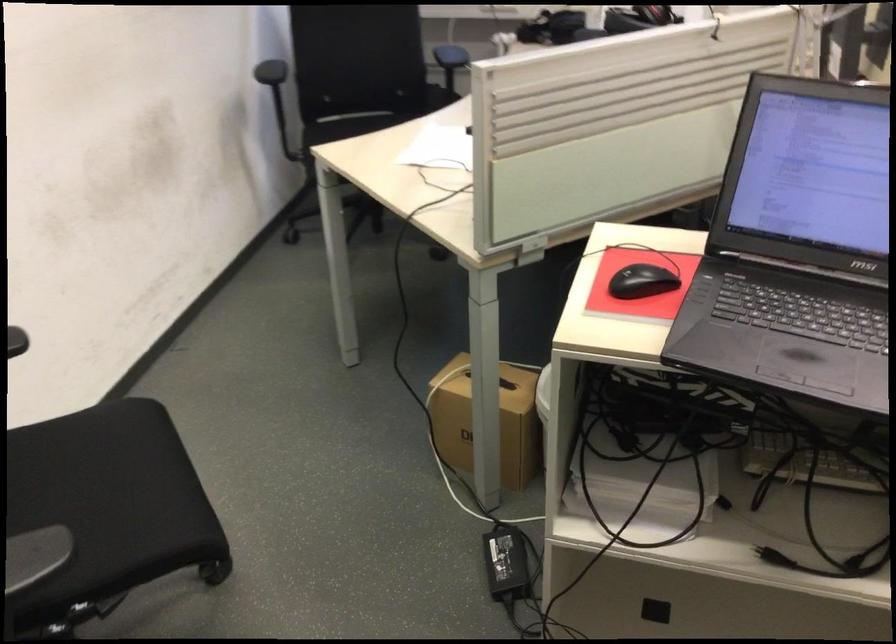
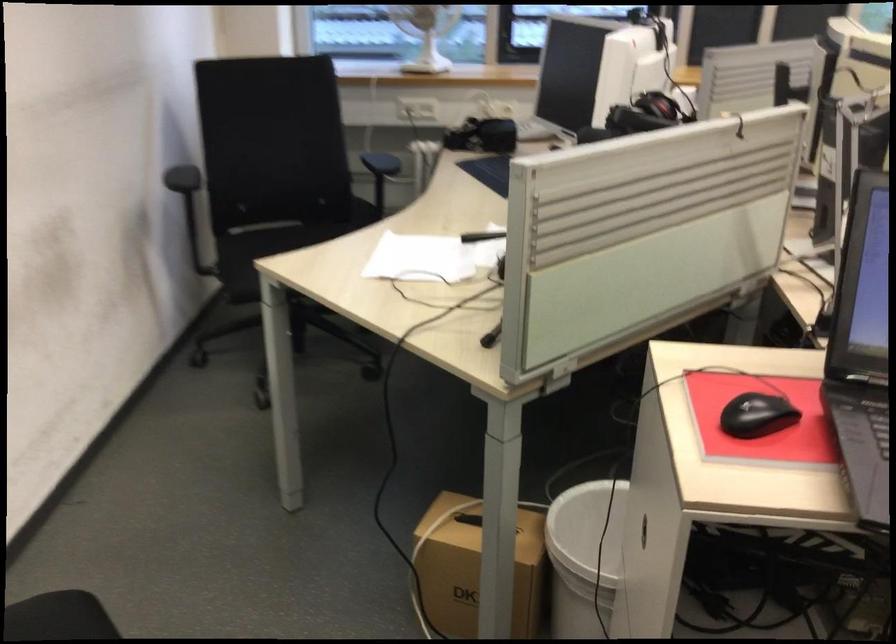
Locate, in the second image, the point that corresponds to the point at 451,149 in the first image.

(419, 259)